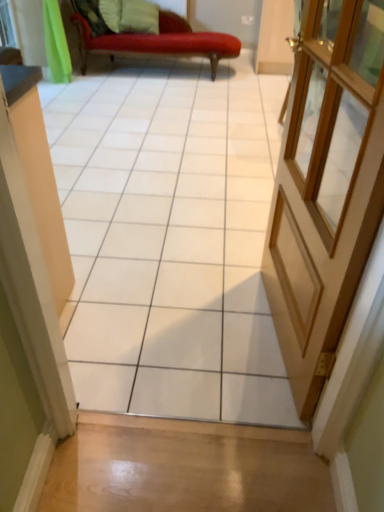
Question: Does green fabric pillow at upper center have a lesser width compared to light brown wooden door at right?

Choices:
 (A) no
 (B) yes

Answer: (A)

Question: Considering the relative sizes of green fabric pillow at upper center and light brown wooden door at right in the image provided, is green fabric pillow at upper center shorter than light brown wooden door at right?

Choices:
 (A) yes
 (B) no

Answer: (A)

Question: Is green fabric pillow at upper center oriented towards light brown wooden door at right?

Choices:
 (A) yes
 (B) no

Answer: (A)

Question: Is green fabric pillow at upper center to the left of light brown wooden door at right from the viewer's perspective?

Choices:
 (A) yes
 (B) no

Answer: (A)

Question: Is green fabric pillow at upper center positioned behind light brown wooden door at right?

Choices:
 (A) yes
 (B) no

Answer: (A)

Question: Is white glossy tile at center inside the boundaries of green fabric pillow at upper center, or outside?

Choices:
 (A) inside
 (B) outside

Answer: (B)

Question: Is white glossy tile at center in front of or behind green fabric pillow at upper center in the image?

Choices:
 (A) front
 (B) behind

Answer: (A)

Question: From a real-world perspective, is white glossy tile at center above or below green fabric pillow at upper center?

Choices:
 (A) below
 (B) above

Answer: (B)

Question: Would you say white glossy tile at center is to the left or to the right of green fabric pillow at upper center in the picture?

Choices:
 (A) right
 (B) left

Answer: (A)

Question: Based on their sizes in the image, would you say white glossy tile at center is bigger or smaller than light brown wooden door at right?

Choices:
 (A) small
 (B) big

Answer: (B)

Question: From the image's perspective, is white glossy tile at center located above or below light brown wooden door at right?

Choices:
 (A) above
 (B) below

Answer: (B)

Question: Is white glossy tile at center in front of or behind light brown wooden door at right in the image?

Choices:
 (A) behind
 (B) front

Answer: (B)

Question: Is white glossy tile at center taller or shorter than light brown wooden door at right?

Choices:
 (A) tall
 (B) short

Answer: (A)

Question: From a real-world perspective, is green fabric pillow at upper center positioned above or below light brown wooden door at right?

Choices:
 (A) above
 (B) below

Answer: (B)

Question: Considering the relative positions of green fabric pillow at upper center and light brown wooden door at right in the image provided, is green fabric pillow at upper center to the left or to the right of light brown wooden door at right?

Choices:
 (A) left
 (B) right

Answer: (A)